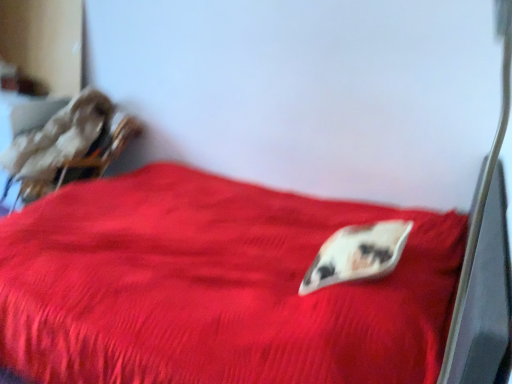
Question: Should I look upward or downward to see velvet-like brown armchair at upper left?

Choices:
 (A) up
 (B) down

Answer: (A)